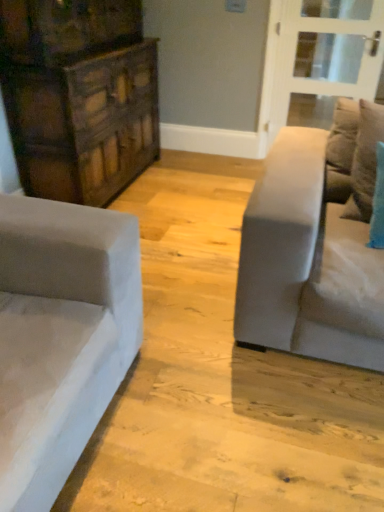
Describe the element at coordinates (365, 161) in the screenshot. Image resolution: width=384 pixels, height=512 pixels. I see `velvet teal pillow at right` at that location.

The image size is (384, 512). I want to click on clear glass door at upper right, so click(x=311, y=76).

The width and height of the screenshot is (384, 512). I want to click on velvet teal pillow at right, so click(x=365, y=161).

Based on the photo, is velvet teal pillow at right completely or partially inside light gray fabric couch at right?

Yes.

Considering the relative sizes of light gray fabric couch at right and velvet teal pillow at right in the image provided, is light gray fabric couch at right smaller than velvet teal pillow at right?

No, light gray fabric couch at right is not smaller than velvet teal pillow at right.

Which is more to the right, light gray fabric couch at right or velvet teal pillow at right?

Positioned to the right is velvet teal pillow at right.

Is light gray fabric couch at right bigger than dark wood dresser at left?

Actually, light gray fabric couch at right might be smaller than dark wood dresser at left.

Which is more distant, (331, 318) or (28, 86)?

The point (28, 86) is behind.

Is light gray fabric couch at right oriented away from dark wood dresser at left?

Yes, light gray fabric couch at right's orientation is away from dark wood dresser at left.

Which object is thinner, light gray fabric couch at right or dark wood dresser at left?

Thinner between the two is dark wood dresser at left.

Image resolution: width=384 pixels, height=512 pixels. Find the location of `dresser behind the velvet teal pillow at right`. dresser behind the velvet teal pillow at right is located at coordinates (79, 96).

Who is taller, velvet teal pillow at right or dark wood dresser at left?

dark wood dresser at left.

Is point (374, 130) positioned before point (47, 158)?

Yes, point (374, 130) is closer to viewer.

How far apart are velvet teal pillow at right and dark wood dresser at left?

They are 5.12 feet apart.

Is light gray fabric couch at right directly adjacent to clear glass door at upper right?

There is a gap between light gray fabric couch at right and clear glass door at upper right.

Is light gray fabric couch at right oriented away from clear glass door at upper right?

No, clear glass door at upper right is not at the back of light gray fabric couch at right.

In the scene shown: From the image's perspective, is light gray fabric couch at right located above or below clear glass door at upper right?

From the image's perspective, light gray fabric couch at right appears below clear glass door at upper right.

Is dark wood dresser at left spatially inside clear glass door at upper right, or outside of it?

dark wood dresser at left is spatially situated outside clear glass door at upper right.

From a real-world perspective, who is located lower, dark wood dresser at left or clear glass door at upper right?

clear glass door at upper right is physically lower.

Is dark wood dresser at left positioned with its back to clear glass door at upper right?

No, dark wood dresser at left's orientation is not away from clear glass door at upper right.

Does velvet teal pillow at right turn towards light gray fabric couch at right?

Yes, velvet teal pillow at right is turned towards light gray fabric couch at right.

From a real-world perspective, between velvet teal pillow at right and light gray fabric couch at right, who is vertically higher?

velvet teal pillow at right.

Is point (358, 207) in front of point (302, 234)?

No, (358, 207) is behind (302, 234).

Considering the relative sizes of velvet teal pillow at right and light gray fabric couch at right in the image provided, is velvet teal pillow at right wider than light gray fabric couch at right?

No, velvet teal pillow at right is not wider than light gray fabric couch at right.

From a real-world perspective, is clear glass door at upper right physically above velvet teal pillow at right?

Actually, clear glass door at upper right is physically below velvet teal pillow at right in the real world.

How different are the orientations of clear glass door at upper right and velvet teal pillow at right in degrees?

There is a 1.64-degree angle between the facing directions of clear glass door at upper right and velvet teal pillow at right.

Considering the relative positions of clear glass door at upper right and velvet teal pillow at right in the image provided, is clear glass door at upper right to the right of velvet teal pillow at right from the viewer's perspective?

Yes, clear glass door at upper right is to the right of velvet teal pillow at right.

Is clear glass door at upper right taller than velvet teal pillow at right?

Yes, clear glass door at upper right is taller than velvet teal pillow at right.

This screenshot has height=512, width=384. What are the coordinates of `studio couch on the left of velvet teal pillow at right` in the screenshot? It's located at (315, 245).

Find the location of a particular element. This screenshot has height=512, width=384. studio couch in front of the dark wood dresser at left is located at coordinates (315, 245).

Looking at the image, which one is located closer to clear glass door at upper right, velvet teal pillow at right or light gray fabric couch at right?

Based on the image, velvet teal pillow at right appears to be nearer to clear glass door at upper right.

Considering their positions, is light gray fabric couch at right positioned further to dark wood dresser at left than velvet teal pillow at right?

velvet teal pillow at right lies further to dark wood dresser at left than the other object.

Based on their spatial positions, is velvet teal pillow at right or dark wood dresser at left closer to clear glass door at upper right?

dark wood dresser at left is closer to clear glass door at upper right.

From the image, which object appears to be nearer to clear glass door at upper right, light gray fabric couch at right or velvet teal pillow at right?

velvet teal pillow at right lies closer to clear glass door at upper right than the other object.

Looking at the image, which one is located closer to light gray fabric couch at right, dark wood dresser at left or clear glass door at upper right?

dark wood dresser at left is positioned closer to the anchor light gray fabric couch at right.

When comparing their distances from clear glass door at upper right, does dark wood dresser at left or velvet teal pillow at right seem closer?

Based on the image, dark wood dresser at left appears to be nearer to clear glass door at upper right.

Which object lies further to the anchor point dark wood dresser at left, velvet teal pillow at right or light gray fabric couch at right?

Among the two, velvet teal pillow at right is located further to dark wood dresser at left.

From the image, which object appears to be farther from light gray fabric couch at right, velvet teal pillow at right or dark wood dresser at left?

The object further to light gray fabric couch at right is dark wood dresser at left.

Identify the location of studio couch between dark wood dresser at left and velvet teal pillow at right. (315, 245).

Locate an element on the screen. This screenshot has height=512, width=384. pillow between dark wood dresser at left and clear glass door at upper right in the horizontal direction is located at coordinates (365, 161).

Locate an element on the screen. This screenshot has width=384, height=512. pillow located between light gray fabric couch at right and clear glass door at upper right in the depth direction is located at coordinates (365, 161).

Locate an element on the screen. The image size is (384, 512). dresser between light gray fabric couch at right and clear glass door at upper right along the z-axis is located at coordinates (79, 96).